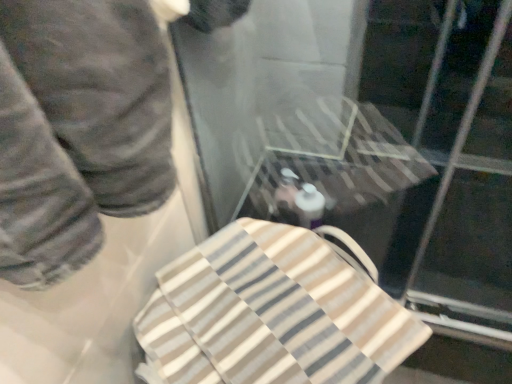
Question: Would you say beige striped towel at center is inside or outside transparent plastic glass door at upper center?

Choices:
 (A) inside
 (B) outside

Answer: (B)

Question: Is beige striped towel at center taller or shorter than transparent plastic glass door at upper center?

Choices:
 (A) tall
 (B) short

Answer: (A)

Question: Based on their relative distances, which object is farther from the dark gray pants at left?

Choices:
 (A) beige striped towel at center
 (B) transparent plastic glass door at upper center

Answer: (B)

Question: Which is farther from the dark gray pants at left?

Choices:
 (A) transparent plastic glass door at upper center
 (B) beige striped towel at center

Answer: (A)